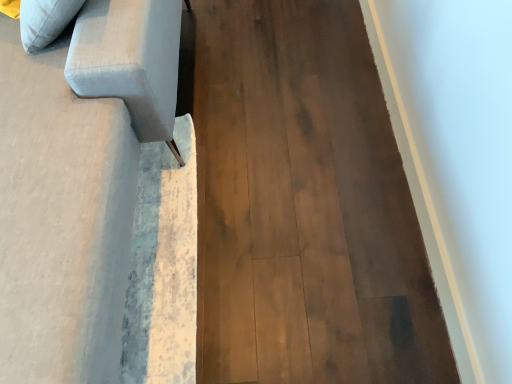
Question: Considering the positions of light gray fabric couch at left and brown wood floor at center in the image, is light gray fabric couch at left bigger or smaller than brown wood floor at center?

Choices:
 (A) small
 (B) big

Answer: (B)

Question: Does point (104, 248) appear closer or farther from the camera than point (361, 23)?

Choices:
 (A) closer
 (B) farther

Answer: (A)

Question: In terms of width, does light gray fabric couch at left look wider or thinner when compared to brown wood floor at center?

Choices:
 (A) wide
 (B) thin

Answer: (A)

Question: From the image's perspective, is brown wood floor at center positioned above or below light gray fabric couch at left?

Choices:
 (A) below
 (B) above

Answer: (A)

Question: Considering their positions, is brown wood floor at center located in front of or behind light gray fabric couch at left?

Choices:
 (A) behind
 (B) front

Answer: (A)

Question: Is brown wood floor at center inside or outside of light gray fabric couch at left?

Choices:
 (A) inside
 (B) outside

Answer: (B)

Question: In terms of size, does brown wood floor at center appear bigger or smaller than light gray fabric couch at left?

Choices:
 (A) big
 (B) small

Answer: (B)